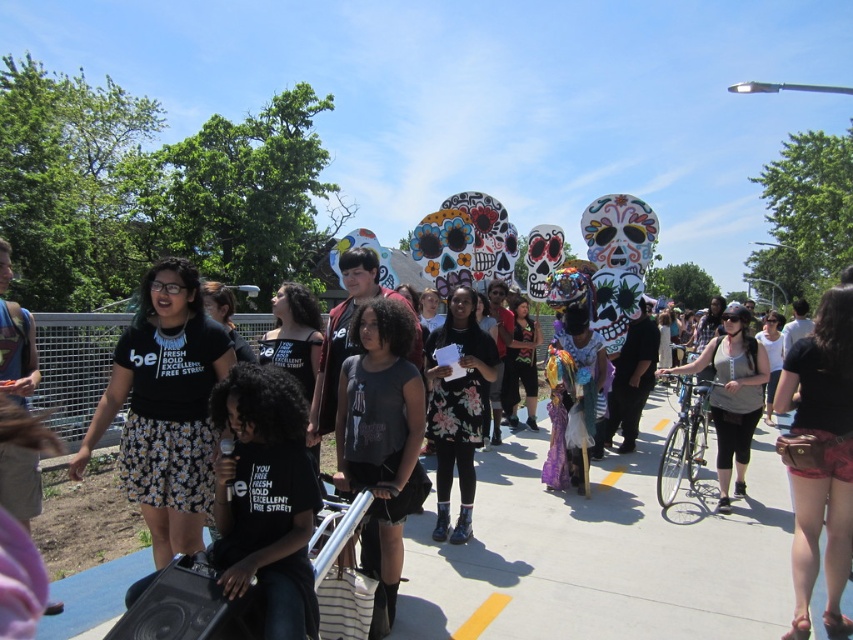
Question: Is black fabric shirt at center in front of dark gray fabric shirt at center?

Choices:
 (A) yes
 (B) no

Answer: (A)

Question: Is the position of floral dress at center more distant than that of matte black tank top at center?

Choices:
 (A) no
 (B) yes

Answer: (A)

Question: Which point appears farthest from the camera in this image?

Choices:
 (A) [x=136, y=337]
 (B) [x=746, y=404]
 (C) [x=380, y=339]

Answer: (B)

Question: Observing the image, what is the correct spatial positioning of leather belt at lower right in reference to matte black tank top at center?

Choices:
 (A) left
 (B) right

Answer: (A)

Question: Which point is closer to the camera?

Choices:
 (A) gray concrete pavement at center
 (B) floral dress at center
 (C) matte black tank top at center
 (D) dark gray fabric shirt at center

Answer: (D)

Question: Estimate the real-world distances between objects in this image. Which object is closer to the black fabric shirt at center?

Choices:
 (A) gray concrete pavement at center
 (B) dark gray fabric shirt at center
 (C) leather belt at lower right
 (D) matte black tank top at center

Answer: (B)